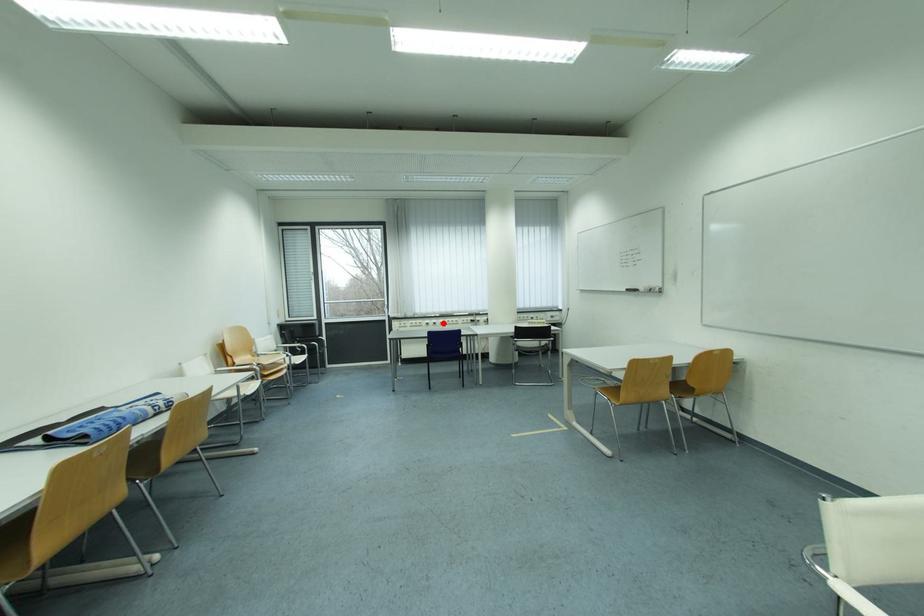
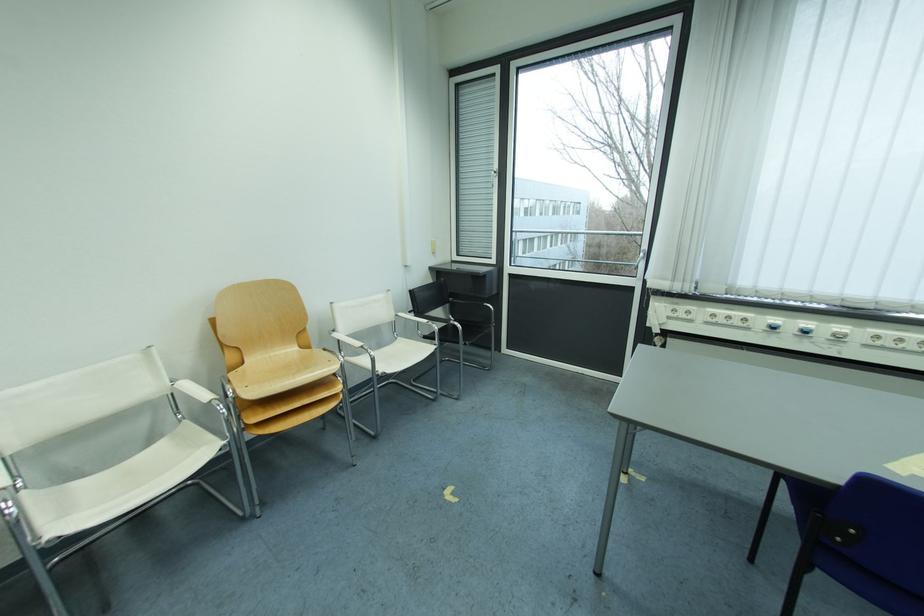
Locate, in the second image, the point that corresponds to the highlighted location in the first image.

(816, 326)